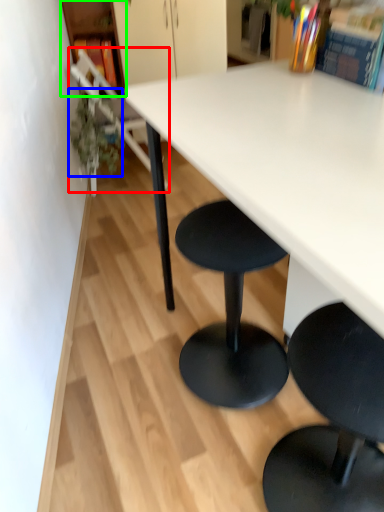
Question: Estimate the real-world distances between objects in this image. Which object is closer to chair (highlighted by a red box), plant (highlighted by a blue box) or shelf (highlighted by a green box)?

Choices:
 (A) plant
 (B) shelf

Answer: (A)